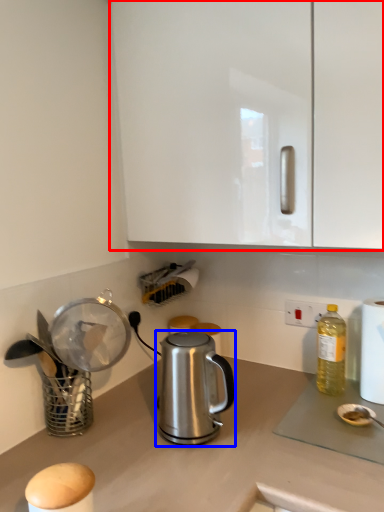
Question: Which object is closer to the camera taking this photo, cabinetry (highlighted by a red box) or kettle (highlighted by a blue box)?

Choices:
 (A) cabinetry
 (B) kettle

Answer: (A)